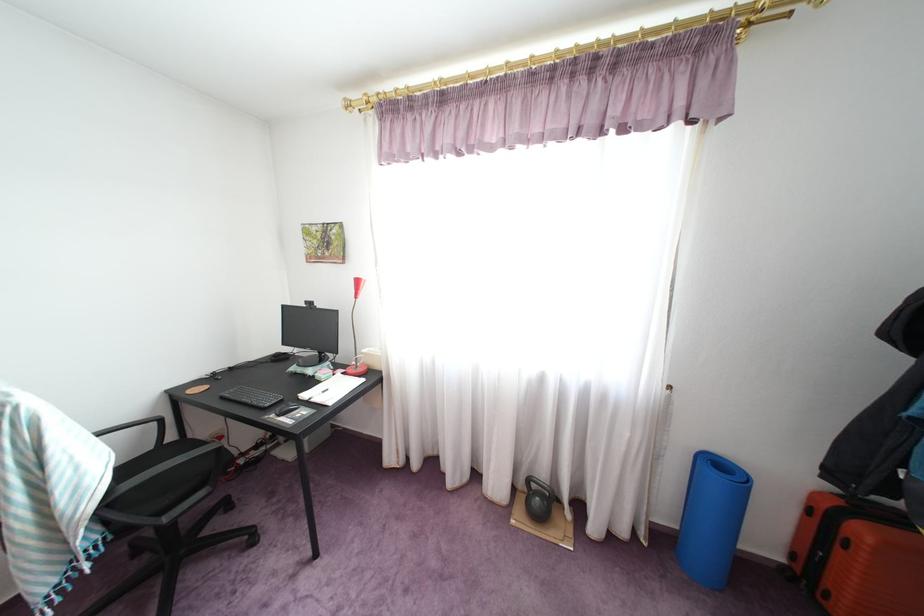
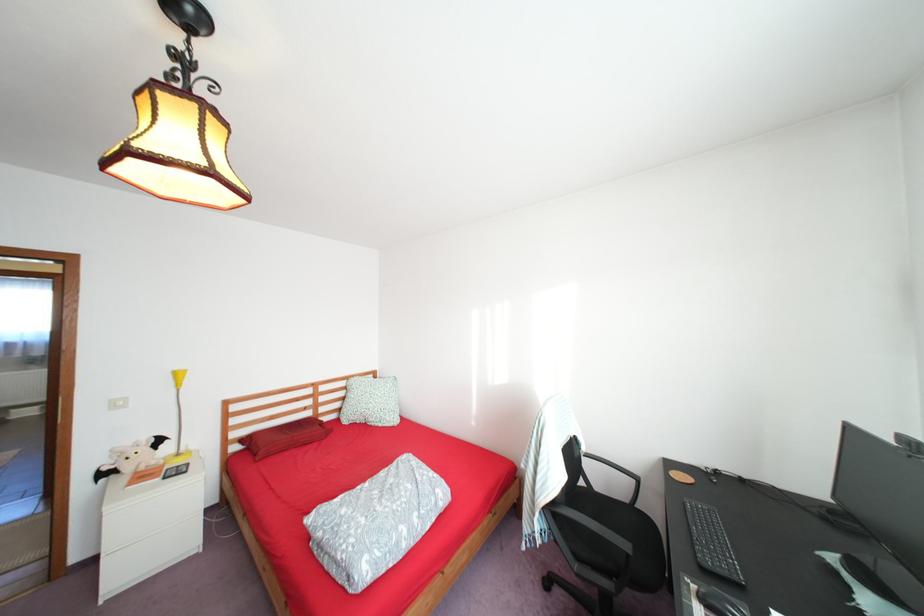
Question: The first image is from the beginning of the video and the second image is from the end. How did the camera likely rotate when shooting the video?

Choices:
 (A) Left
 (B) Right
 (C) Up
 (D) Down

Answer: (A)